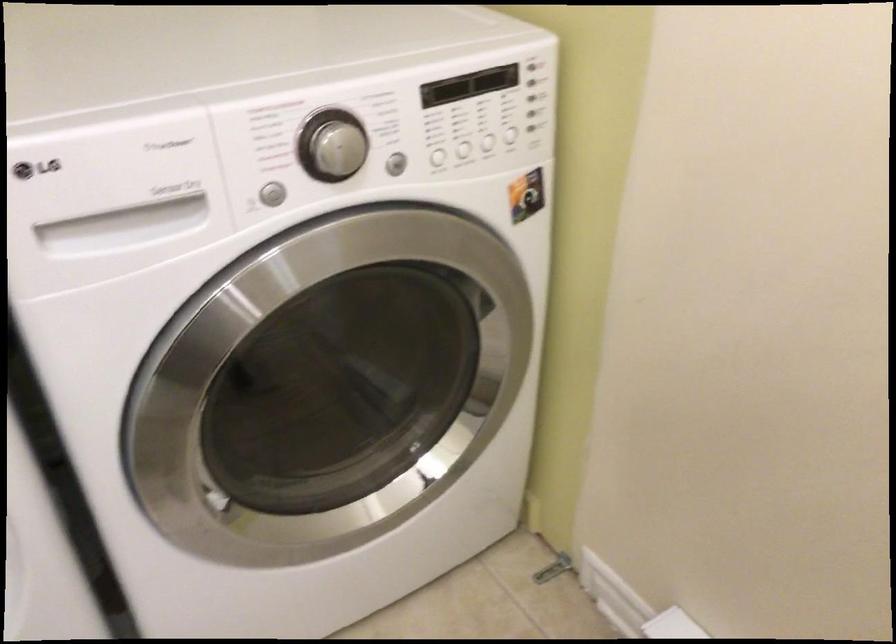
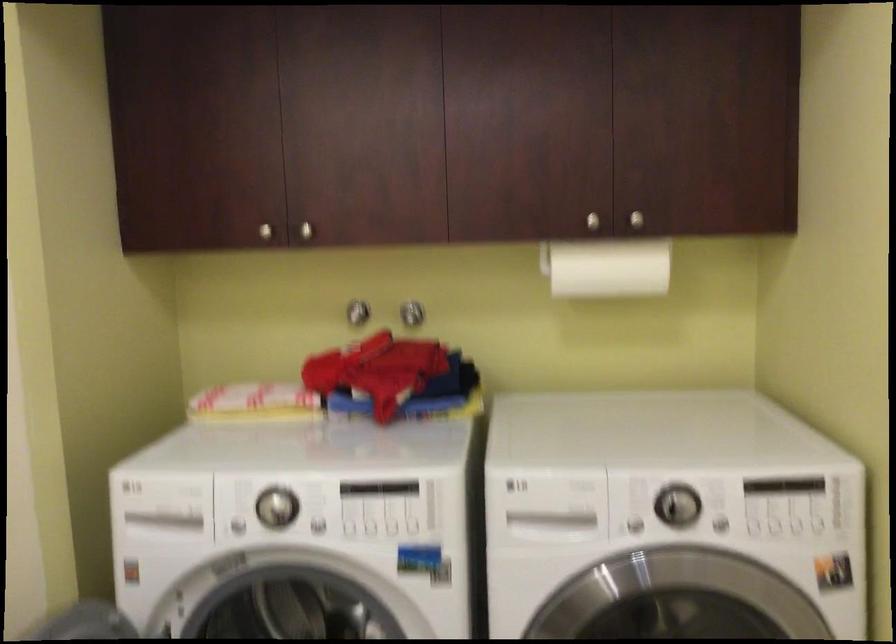
First-person continuous shooting, in which direction is the camera rotating?

The rotation direction of the camera is left-up.